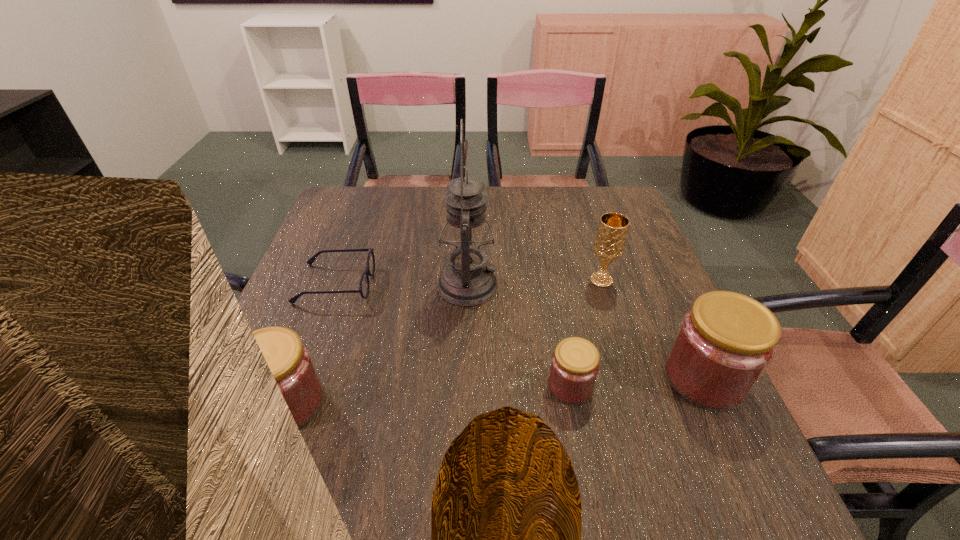
Locate an element on the screen. the second tallest jam is located at coordinates (290, 360).

Where is `the leftmost jam`? The height and width of the screenshot is (540, 960). the leftmost jam is located at coordinates (290, 360).

This screenshot has width=960, height=540. Identify the location of the second shortest object. (575, 363).

Locate an element on the screen. the second jam from right to left is located at coordinates (575, 363).

Where is `the rightmost jam`? This screenshot has width=960, height=540. the rightmost jam is located at coordinates (724, 344).

Find the location of a particular element. the shortest object is located at coordinates (364, 286).

Image resolution: width=960 pixels, height=540 pixels. Find the location of `the fifth object from left to right`. the fifth object from left to right is located at coordinates (610, 239).

Where is `the tallest object`? the tallest object is located at coordinates (467, 279).

Find the location of a particular element. oil lamp is located at coordinates (467, 279).

This screenshot has height=540, width=960. I want to click on vacant area located 0.370m on the back of the second shortest jam, so click(x=342, y=259).